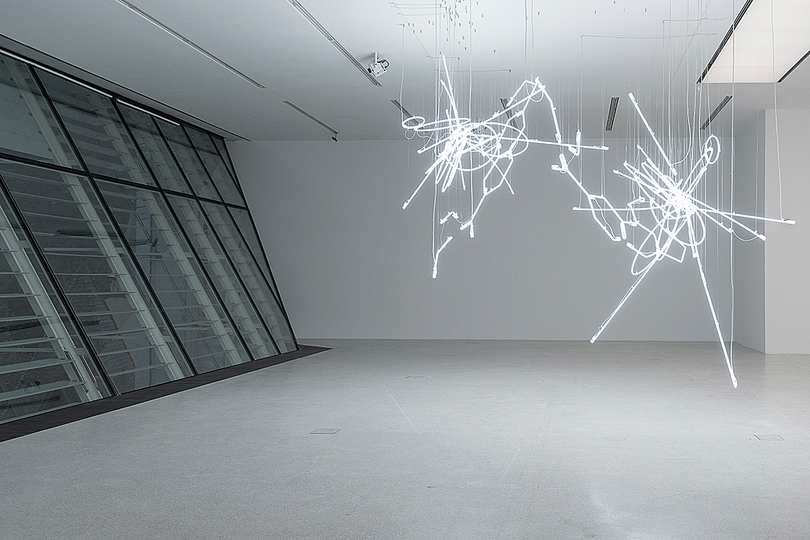
Locate an element on the screen. This screenshot has height=540, width=810. white wall is located at coordinates (363, 229), (791, 297).